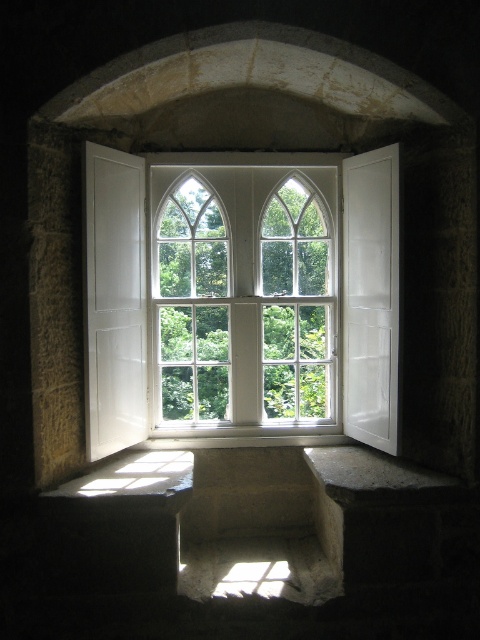
Who is lower down, white wooden bay window at center or white glass window at center?

white wooden bay window at center is below.

Where is `white wooden bay window at center`? white wooden bay window at center is located at coordinates (241, 298).

Who is more forward, (228, 316) or (325, 268)?

Point (228, 316) is in front.

Locate an element on the screen. The image size is (480, 640). white wooden bay window at center is located at coordinates (241, 298).